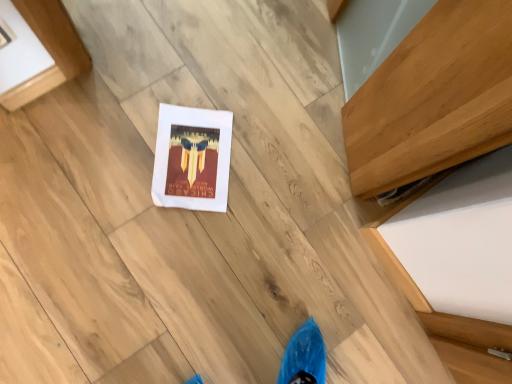
At what (x,y) coordinates should I click in order to perform the action: click on vacant space in front of white paper at center. Please return your answer as a coordinate pair (x, y). The height and width of the screenshot is (384, 512). Looking at the image, I should click on [x=141, y=227].